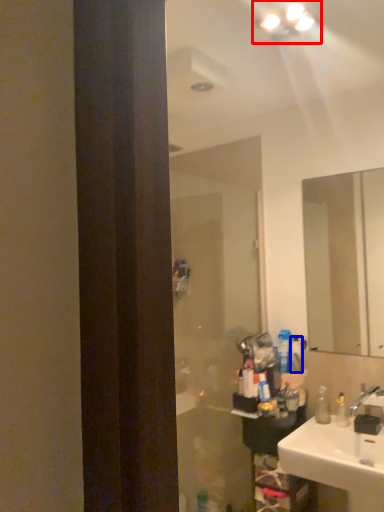
Question: Among these objects, which one is nearest to the camera, light fixture (highlighted by a red box) or toiletry (highlighted by a blue box)?

Choices:
 (A) light fixture
 (B) toiletry

Answer: (A)